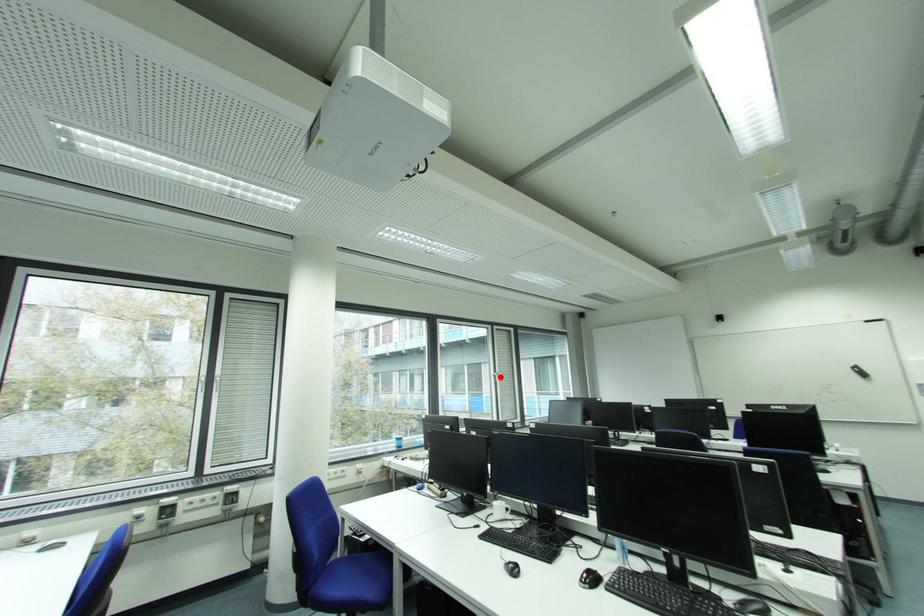
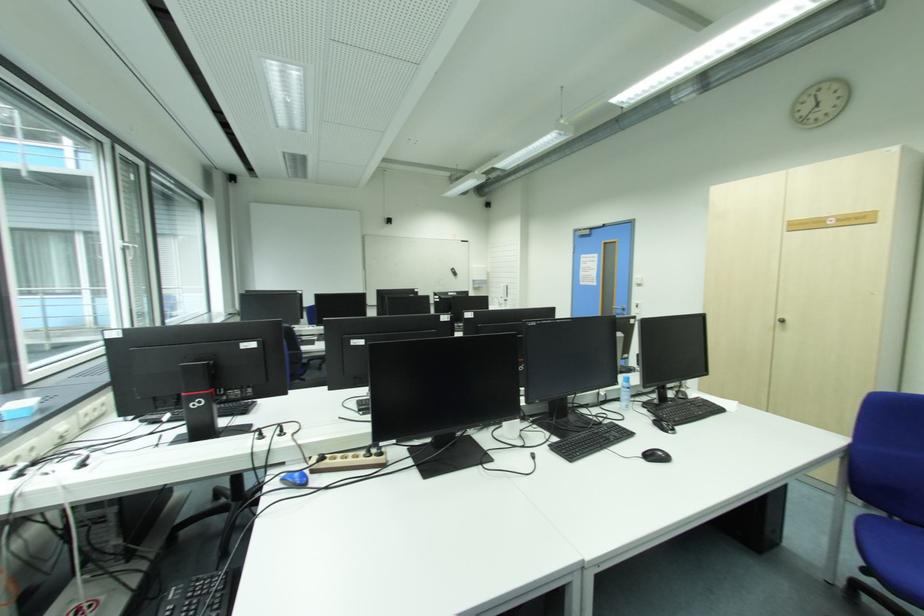
The point at the highlighted location is marked in the first image. Where is the corresponding point in the second image?

(131, 249)